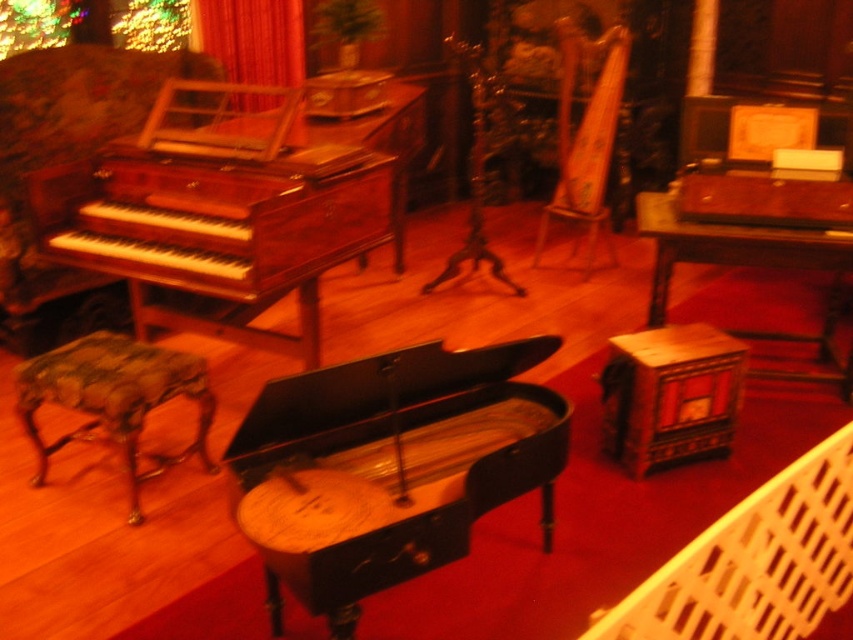
Question: Is the position of wooden lattice chair at lower right less distant than that of velvet upholstered armchair at left?

Choices:
 (A) no
 (B) yes

Answer: (B)

Question: Which object is closer to the camera taking this photo?

Choices:
 (A) mahogany polished piano at left
 (B) velvet upholstered armchair at left
 (C) black polished piano at center
 (D) wooden lattice chair at lower right

Answer: (D)

Question: Does black polished piano at center appear over camouflage fabric stool at lower left?

Choices:
 (A) no
 (B) yes

Answer: (A)

Question: Which of the following is the farthest from the observer?

Choices:
 (A) camouflage fabric stool at lower left
 (B) velvet curtain at upper left
 (C) black polished piano at center
 (D) wooden stool at lower right

Answer: (B)

Question: In this image, where is wooden lattice chair at lower right located relative to velvet curtain at upper left?

Choices:
 (A) above
 (B) below

Answer: (B)

Question: Which object is the closest to the wooden lattice chair at lower right?

Choices:
 (A) velvet upholstered armchair at left
 (B) black polished piano at center

Answer: (B)